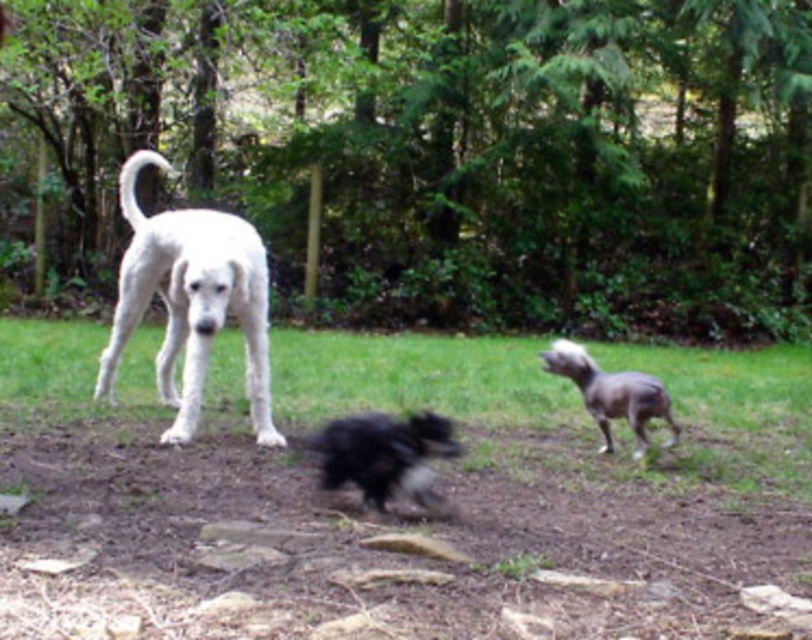
You are standing at the point marked by the coordinate point at (x=657, y=513). You want to throw a ball to the large white dog on the left. Can you reach it with a throw of 20 feet?

The distance between the point at (x=657, y=513) and the large white dog on the left is 19.28 feet. Since your throw can reach 20 feet, you can successfully throw the ball to the large white dog on the left.

You are a photographer setting up a tripod to capture a photo of the white fur dog at left and the shaggy black dog at center. The tripod requires a minimum distance of 5 feet between the two dogs to focus properly. Based on the scene, will the tripod be able to focus on both dogs simultaneously?

The white fur dog at left and shaggy black dog at center are 5.35 feet apart, which is more than the required 5 feet. Therefore, the tripod can focus on both dogs simultaneously.

Looking at this image, you are a photographer standing in the park and want to capture a closeup shot of the brown dirt field at center. Your camera has a minimum focusing distance of 2 meters. Can you take the photo without moving closer?

The brown dirt field at center is 3.90 meters away from the camera. Since your camera can focus as close as 2 meters, you can take the closeup shot without moving closer because the distance is within the camera s minimum focusing range.